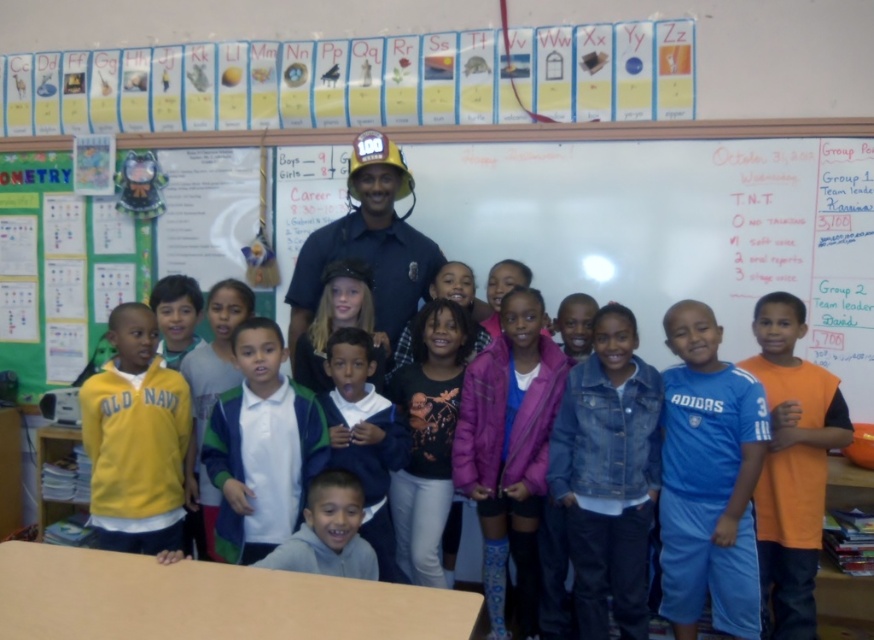
Consider the image. You are a student in the classroom and want to reach both the point at coordinates (170,493) and the point at (234,385). Which point will you reach first?

You will reach point (170,493) first because it is closer to you than point (234,385).

You are a photographer trying to capture a group photo of the children and the firefighter. You need to ensure that the yellow fleece jacket at left and the dark blue uniform at center are both visible in the frame. Based on their positions, which object should be closer to the left edge of the photo?

The yellow fleece jacket at left is to the left of the dark blue uniform at center, so the yellow fleece jacket at left should be closer to the left edge of the photo.